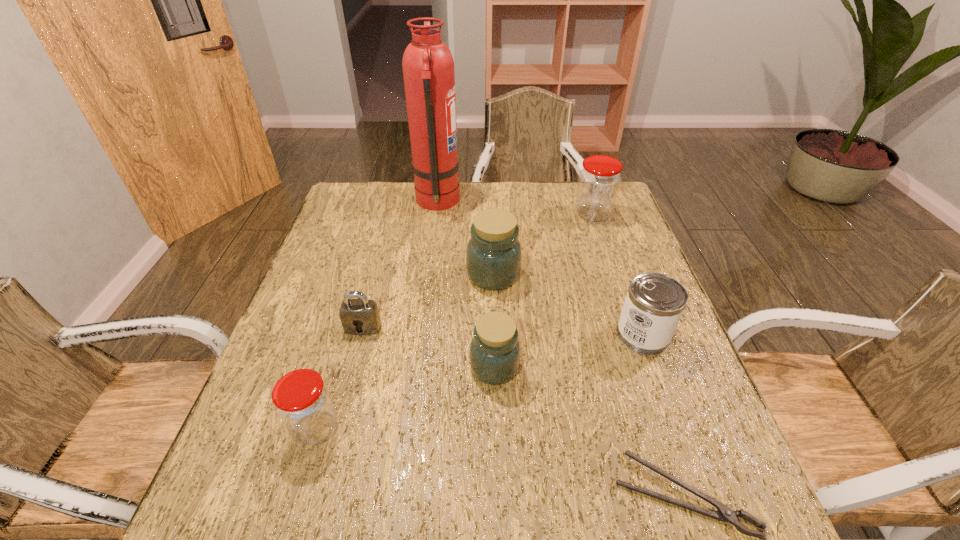
Image resolution: width=960 pixels, height=540 pixels. I want to click on jar present at the far edge, so pos(599,180).

Locate an element on the screen. The width and height of the screenshot is (960, 540). jar present at the left edge is located at coordinates point(302,400).

The width and height of the screenshot is (960, 540). Identify the location of padlock that is at the left edge. (360, 316).

Locate an element on the screen. jar that is at the right edge is located at coordinates pos(599,180).

The width and height of the screenshot is (960, 540). Find the location of `can present at the right edge`. can present at the right edge is located at coordinates (654, 304).

Locate an element on the screen. Image resolution: width=960 pixels, height=540 pixels. object that is at the far right corner is located at coordinates (599, 180).

Identify the location of vacant space at the far edge. Image resolution: width=960 pixels, height=540 pixels. (444, 214).

Locate an element on the screen. free space at the right edge of the desktop is located at coordinates (710, 423).

The height and width of the screenshot is (540, 960). Find the location of `vacant region at the far left corner of the desktop`. vacant region at the far left corner of the desktop is located at coordinates (350, 204).

Identify the location of vacant space at the far right corner of the desktop. (570, 197).